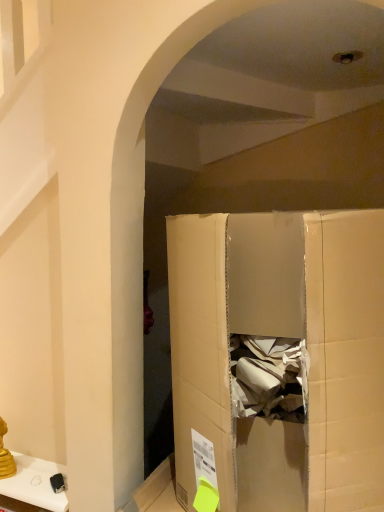
Describe the element at coordinates (289, 342) in the screenshot. The width and height of the screenshot is (384, 512). I see `cardboard box at center` at that location.

Measure the distance between point (171, 278) and camera.

Point (171, 278) and camera are 3.44 feet apart.

You are a GUI agent. You are given a task and a screenshot of the screen. Output one action in this format:
    pyautogui.click(x=<x>, y=<y>)
    Task: Click on the cardboard box at center
    The image size is (384, 512).
    Given the screenshot: What is the action you would take?
    pyautogui.click(x=289, y=342)

This screenshot has width=384, height=512. What do you see at coordinates (35, 483) in the screenshot? I see `metallic gold candlestick at lower left` at bounding box center [35, 483].

The width and height of the screenshot is (384, 512). What are the coordinates of `metallic gold candlestick at lower left` in the screenshot? It's located at (35, 483).

In order to click on cardboard box at center in this screenshot , I will do `click(289, 342)`.

Would you say cardboard box at center is to the left or to the right of metallic gold candlestick at lower left in the picture?

Based on their positions, cardboard box at center is located to the right of metallic gold candlestick at lower left.

Which object is closer to the camera taking this photo, cardboard box at center or metallic gold candlestick at lower left?

cardboard box at center.

Which is further, (x=205, y=224) or (x=34, y=489)?

The point (x=34, y=489) is behind.

From the image's perspective, would you say cardboard box at center is positioned over metallic gold candlestick at lower left?

Yes.

From a real-world perspective, is cardboard box at center positioned above or below metallic gold candlestick at lower left?

Clearly, from a real-world perspective, cardboard box at center is above metallic gold candlestick at lower left.

Between cardboard box at center and metallic gold candlestick at lower left, which one has smaller width?

metallic gold candlestick at lower left.

Considering the sizes of cardboard box at center and metallic gold candlestick at lower left in the image, is cardboard box at center taller or shorter than metallic gold candlestick at lower left?

cardboard box at center is taller than metallic gold candlestick at lower left.

Considering the sizes of objects cardboard box at center and metallic gold candlestick at lower left in the image provided, who is bigger, cardboard box at center or metallic gold candlestick at lower left?

With larger size is cardboard box at center.

Is cardboard box at center positioned beyond the bounds of metallic gold candlestick at lower left?

cardboard box at center lies outside metallic gold candlestick at lower left's area.

Are cardboard box at center and metallic gold candlestick at lower left beside each other?

No.

Is cardboard box at center aimed at metallic gold candlestick at lower left?

No, cardboard box at center is not turned towards metallic gold candlestick at lower left.

How many degrees apart are the facing directions of cardboard box at center and metallic gold candlestick at lower left?

The angular difference between cardboard box at center and metallic gold candlestick at lower left is 2.3 degrees.

How much distance is there between cardboard box at center and metallic gold candlestick at lower left?

cardboard box at center is 26.26 inches away from metallic gold candlestick at lower left.

In the image, there is a cardboard box at center. Identify the location of furniture below it (from the image's perspective). (35, 483).

Which object is positioned more to the left, metallic gold candlestick at lower left or cardboard box at center?

metallic gold candlestick at lower left.

Does metallic gold candlestick at lower left lie in front of cardboard box at center?

No, metallic gold candlestick at lower left is further to the viewer.

Which is behind, point (15, 474) or point (344, 262)?

Point (15, 474)

From the image's perspective, is metallic gold candlestick at lower left beneath cardboard box at center?

Indeed, from the image's perspective, metallic gold candlestick at lower left is shown beneath cardboard box at center.

From a real-world perspective, between metallic gold candlestick at lower left and cardboard box at center, who is vertically lower?

In real-world perspective, metallic gold candlestick at lower left is lower.

Can you confirm if metallic gold candlestick at lower left is wider than cardboard box at center?

No, metallic gold candlestick at lower left is not wider than cardboard box at center.

From their relative heights in the image, would you say metallic gold candlestick at lower left is taller or shorter than cardboard box at center?

Clearly, metallic gold candlestick at lower left is shorter compared to cardboard box at center.

Considering the relative sizes of metallic gold candlestick at lower left and cardboard box at center in the image provided, is metallic gold candlestick at lower left smaller than cardboard box at center?

Yes.

Can cardboard box at center be found inside metallic gold candlestick at lower left?

Actually, cardboard box at center is outside metallic gold candlestick at lower left.

Is metallic gold candlestick at lower left beside cardboard box at center?

No, metallic gold candlestick at lower left is not with cardboard box at center.

Is metallic gold candlestick at lower left oriented away from cardboard box at center?

metallic gold candlestick at lower left is not turned away from cardboard box at center.

How many degrees apart are the facing directions of metallic gold candlestick at lower left and cardboard box at center?

2.3 degrees separate the facing orientations of metallic gold candlestick at lower left and cardboard box at center.

How distant is metallic gold candlestick at lower left from cardboard box at center?

metallic gold candlestick at lower left and cardboard box at center are 26.26 inches apart from each other.

The height and width of the screenshot is (512, 384). I want to click on furniture below the cardboard box at center (from the image's perspective), so click(35, 483).

Where is `cardboard box above the metallic gold candlestick at lower left (from a real-world perspective)`? cardboard box above the metallic gold candlestick at lower left (from a real-world perspective) is located at coordinates coord(289,342).

Locate an element on the screen. The image size is (384, 512). furniture that appears below the cardboard box at center (from a real-world perspective) is located at coordinates (35, 483).